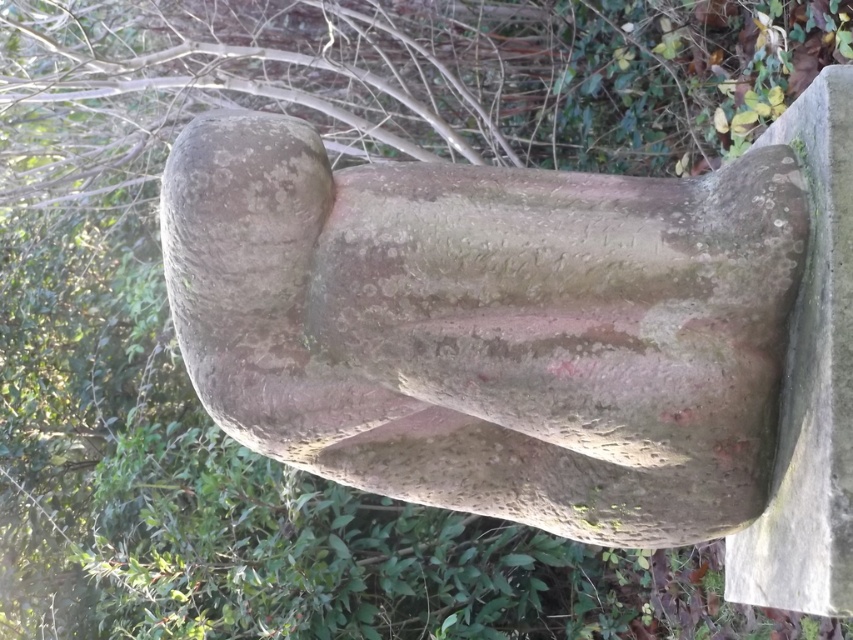
You are an artist planning to place a new sculpture next to the speckled stone statue at center and the speckled concrete bench at right. You need to know which object is wider to determine where to position your new piece. Which one is wider?

The speckled stone statue at center is wider than the speckled concrete bench at right according to the description.

You are a visitor at a park and see the speckled stone statue at center and the speckled concrete bench at right. Which object is larger in size?

The speckled stone statue at center is bigger than the speckled concrete bench at right.